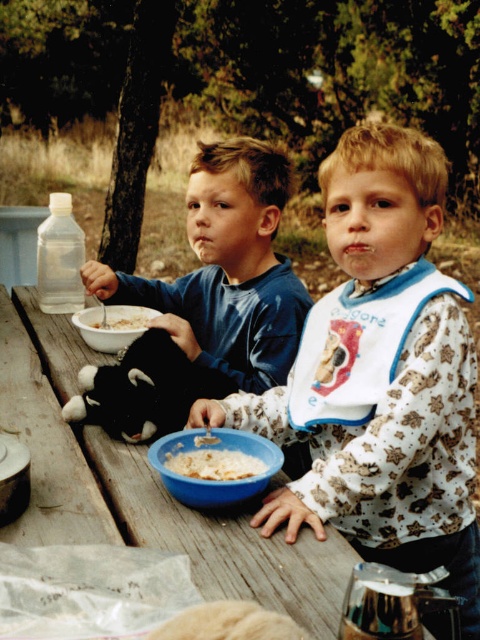
Can you confirm if blue cotton shirt at center is positioned below white matte bowl at center?

Incorrect, blue cotton shirt at center is not positioned below white matte bowl at center.

Does blue cotton shirt at center have a smaller size compared to white matte bowl at center?

No.

Where is `blue cotton shirt at center`? This screenshot has height=640, width=480. blue cotton shirt at center is located at coordinates (227, 269).

Is matte plastic bowl of cereal at center to the right of white matte bowl at center from the viewer's perspective?

Indeed, matte plastic bowl of cereal at center is positioned on the right side of white matte bowl at center.

Which is in front, point (243, 481) or point (113, 314)?

Point (243, 481)

Identify the location of matte plastic bowl of cereal at center. (214, 481).

Can you confirm if blue cotton shirt at center is smaller than white creamy cereal at bowl center?

Incorrect, blue cotton shirt at center is not smaller in size than white creamy cereal at bowl center.

Which of these two, blue cotton shirt at center or white creamy cereal at bowl center, stands taller?

blue cotton shirt at center

Is point (155, 300) less distant than point (133, 316)?

No, it is not.

Locate an element on the screen. This screenshot has height=640, width=480. blue cotton shirt at center is located at coordinates (227, 269).